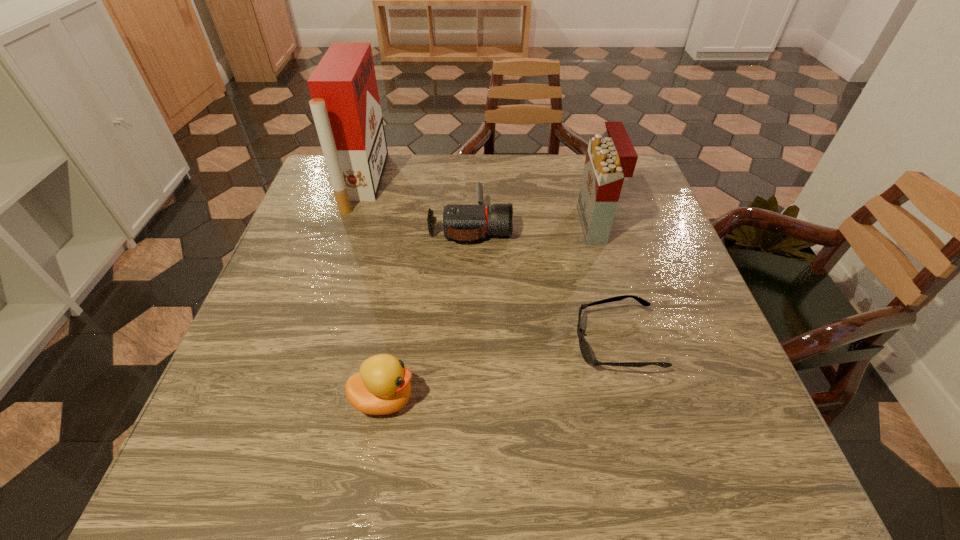
Find the location of a particular element. The image size is (960, 540). the leftmost object is located at coordinates (345, 104).

The image size is (960, 540). Identify the location of the taller cigarette case. (345, 104).

This screenshot has height=540, width=960. Identify the location of the right cigarette case. (609, 160).

The height and width of the screenshot is (540, 960). In order to click on the shorter cigarette case in this screenshot , I will do `click(609, 160)`.

Image resolution: width=960 pixels, height=540 pixels. Identify the location of the third shortest object. (382, 386).

Image resolution: width=960 pixels, height=540 pixels. Identify the location of duckling. (382, 386).

Identify the location of camcorder. This screenshot has height=540, width=960. (464, 222).

The image size is (960, 540). In order to click on the shortest object in this screenshot , I will do `click(584, 348)`.

Locate an element on the screen. sunglasses is located at coordinates (584, 348).

Find the location of `free spot located 0.140m on the front-facing side of the left cigarette case`. free spot located 0.140m on the front-facing side of the left cigarette case is located at coordinates (430, 182).